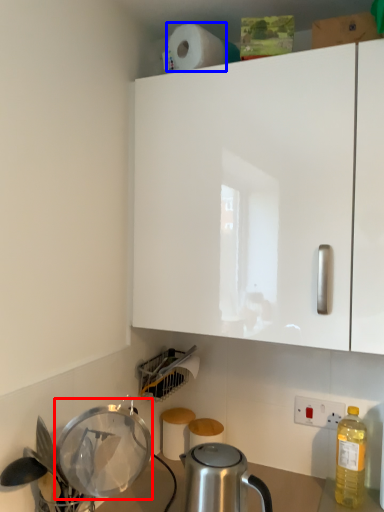
Question: Which point is further to the camera, appliance (highlighted by a red box) or paper towel (highlighted by a blue box)?

Choices:
 (A) appliance
 (B) paper towel

Answer: (B)